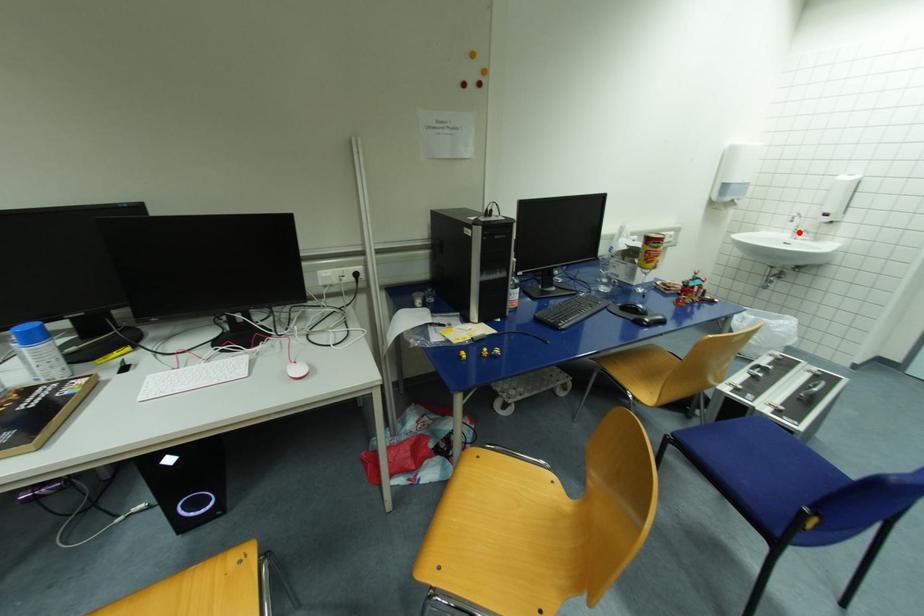
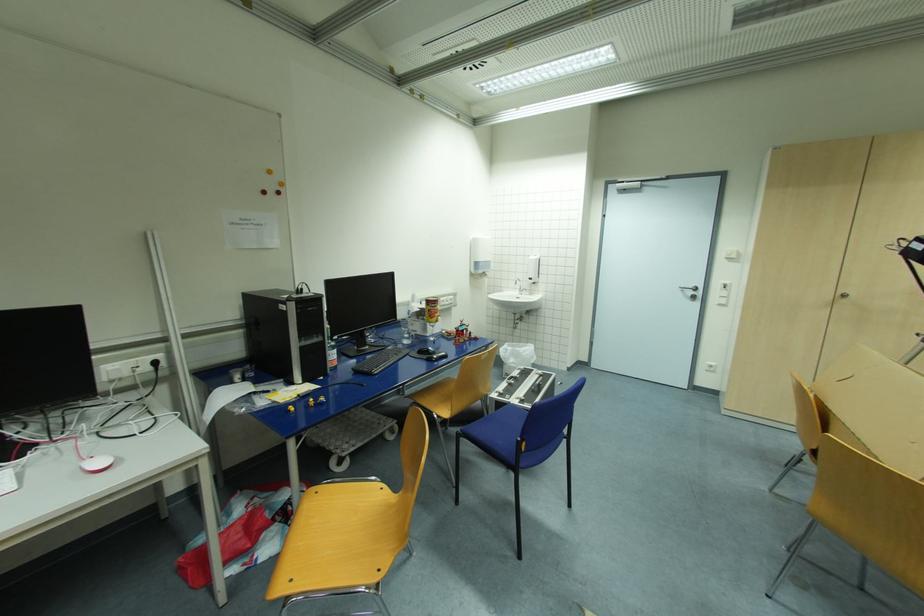
Where in the second image is the point corresponding to the highlighted location from the first image?

(525, 291)